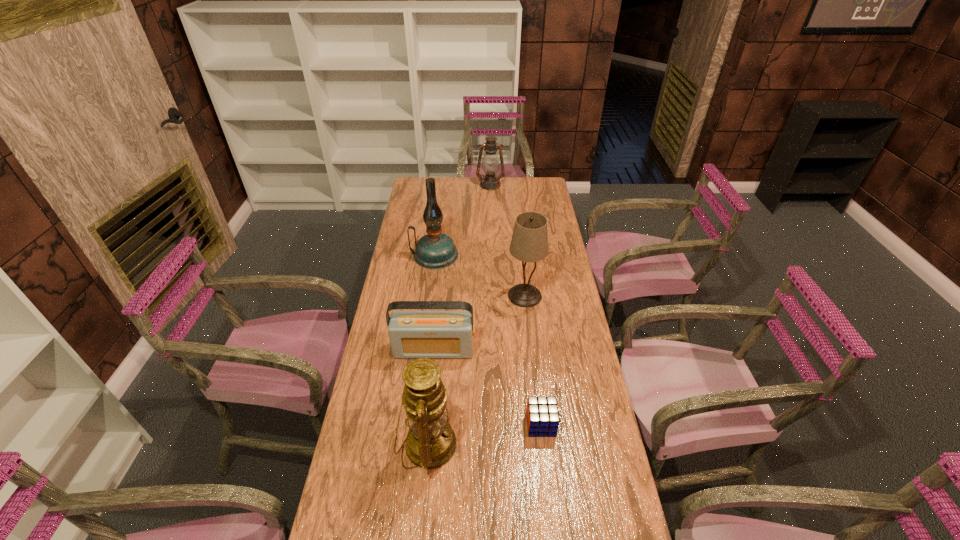
The height and width of the screenshot is (540, 960). In the image, there is a desktop. Find the location of `free space at the right edge`. free space at the right edge is located at coordinates (556, 238).

In the image, there is a desktop. What are the coordinates of `vacant space at the far right corner` in the screenshot? It's located at (530, 181).

You are a GUI agent. You are given a task and a screenshot of the screen. Output one action in this format:
    pyautogui.click(x=<x>, y=<y>)
    Task: Click on the free space between the cube and the second farthest object
    
    Given the screenshot: What is the action you would take?
    pyautogui.click(x=488, y=340)

Where is `blank region between the shortest object and the second farthest object`? blank region between the shortest object and the second farthest object is located at coordinates (488, 340).

The width and height of the screenshot is (960, 540). I want to click on free point between the cube and the nearest oil lamp, so click(485, 434).

Image resolution: width=960 pixels, height=540 pixels. I want to click on free spot between the third farthest object and the cube, so click(x=533, y=360).

You are a GUI agent. You are given a task and a screenshot of the screen. Output one action in this format:
    pyautogui.click(x=<x>, y=<y>)
    Task: Click on the free space between the nearest oil lamp and the cube
    
    Given the screenshot: What is the action you would take?
    pyautogui.click(x=485, y=434)

Where is `free space between the rightmost oil lamp and the third farthest object`? free space between the rightmost oil lamp and the third farthest object is located at coordinates (508, 240).

Image resolution: width=960 pixels, height=540 pixels. What are the coordinates of `empty space that is in between the fifth nearest object and the lampshade` in the screenshot? It's located at (480, 275).

You are a GUI agent. You are given a task and a screenshot of the screen. Output one action in this format:
    pyautogui.click(x=<x>, y=<y>)
    Task: Click on the vacant area between the second farthest object and the third farthest object
    
    Given the screenshot: What is the action you would take?
    pyautogui.click(x=480, y=275)